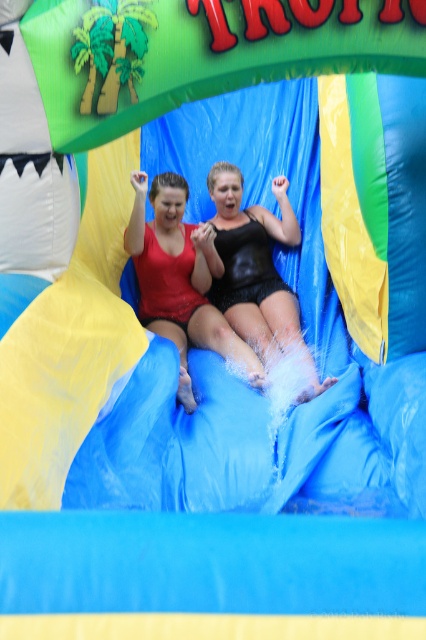
Between point (164, 253) and point (268, 316), which one is positioned in front?

Positioned in front is point (268, 316).

Can you confirm if matte red swimsuit at center is bigger than black shiny shorts at center?

Actually, matte red swimsuit at center might be smaller than black shiny shorts at center.

What are the coordinates of `matte red swimsuit at center` in the screenshot? It's located at (178, 280).

Where is `matte red swimsuit at center`? matte red swimsuit at center is located at coordinates (178, 280).